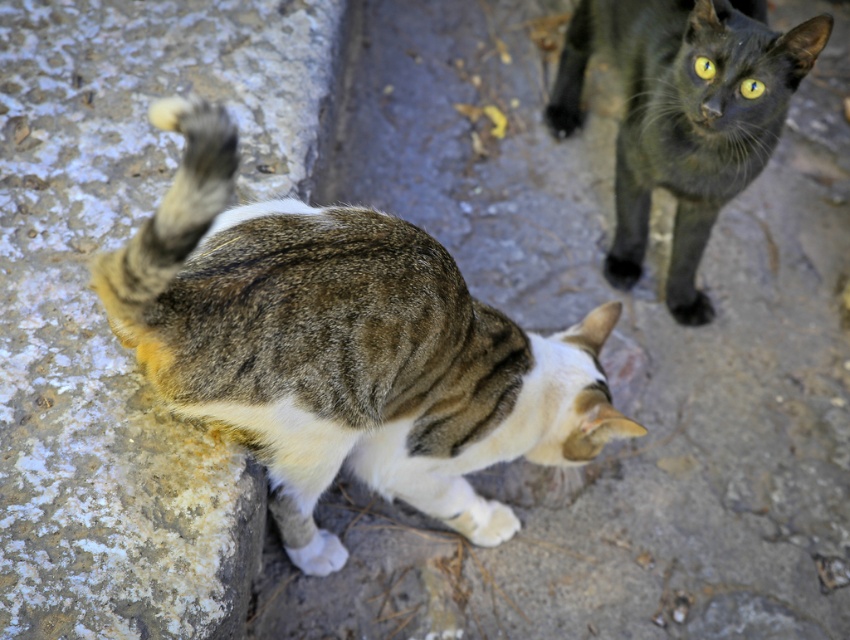
Based on the photo, you are a photographer trying to capture both cats in the frame. Given that the tabby fur cat at lower left and the shiny black cat at upper right are on the same surface, which cat would require you to adjust your camera angle more to include in the shot?

The tabby fur cat at lower left might require adjusting the camera angle more because it is wider than the shiny black cat at upper right, so it might take up more space in the frame.

You are a cat owner who wants to place a new cat toy on the rusty concrete stone at lower left. If you are standing 5 feet away from the stone, can you safely throw the toy to land on it without overestimating the distance?

The rusty concrete stone at lower left is 4.38 feet away from the viewer. Since you are standing 5 feet away, which is slightly farther than the actual distance, you might overestimate and throw too hard. It is safer to step closer before throwing to ensure accuracy.

You are a photographer trying to capture both cats in the scene. The tabby fur cat at lower left is at point 0.545, 0.405. Where should you position your camera to ensure both cats are in frame?

To capture both cats, position the camera centrally between their positions, ensuring the tabby fur cat at lower left is framed appropriately at its coordinates.